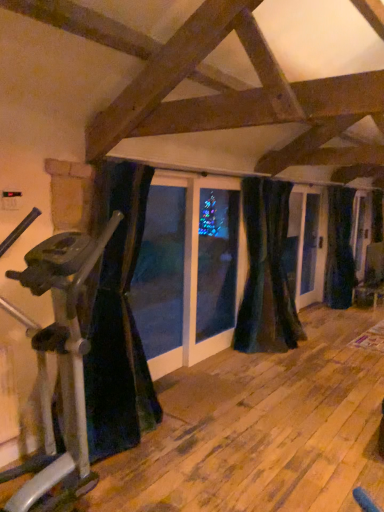
This screenshot has width=384, height=512. Describe the element at coordinates (267, 272) in the screenshot. I see `velvet dark blue curtain at center, which is the 2th curtain from back to front` at that location.

The height and width of the screenshot is (512, 384). Describe the element at coordinates (116, 318) in the screenshot. I see `black velvet curtain at left, positioned as the third curtain in right-to-left order` at that location.

Where is `black velvet curtain at left, arranged as the first curtain when viewed from the front`? black velvet curtain at left, arranged as the first curtain when viewed from the front is located at coordinates (116, 318).

The height and width of the screenshot is (512, 384). What do you see at coordinates (58, 367) in the screenshot?
I see `silver metallic stationary bicycle at left` at bounding box center [58, 367].

This screenshot has height=512, width=384. I want to click on velvet dark blue curtain at center, which appears as the second curtain when viewed from the right, so click(267, 272).

Is velvet dark blue curtain at center, which appears as the second curtain when viewed from the right, situated inside silver metallic stationary bicycle at left or outside?

The correct answer is: outside.

In terms of height, does velvet dark blue curtain at center, which appears as the 2th curtain when viewed from the left, look taller or shorter compared to silver metallic stationary bicycle at left?

Clearly, velvet dark blue curtain at center, which appears as the 2th curtain when viewed from the left, is taller compared to silver metallic stationary bicycle at left.

Between point (264, 342) and point (54, 279), which one is positioned behind?

The point (264, 342) is behind.

Which curtain is the 1st one when counting from the back of the black velvet curtain at left, positioned as the third curtain in right-to-left order? Please provide its 2D coordinates.

[(267, 272)]

From the image's perspective, is black velvet curtain at left, arranged as the first curtain when viewed from the front, above or below velvet dark blue curtain at center, marked as the 2th curtain in a front-to-back arrangement?

From the image's perspective, black velvet curtain at left, arranged as the first curtain when viewed from the front, appears below velvet dark blue curtain at center, marked as the 2th curtain in a front-to-back arrangement.

In the image, is black velvet curtain at left, positioned as the third curtain in right-to-left order, on the left side or the right side of velvet dark blue curtain at center, marked as the 2th curtain in a front-to-back arrangement?

black velvet curtain at left, positioned as the third curtain in right-to-left order, is positioned on velvet dark blue curtain at center, marked as the 2th curtain in a front-to-back arrangement,'s left side.

Is black velvet curtain at left, which appears as the 3th curtain when viewed from the back, oriented towards velvet dark blue curtain at center, which is the 2th curtain from back to front?

No, black velvet curtain at left, which appears as the 3th curtain when viewed from the back, is not aimed at velvet dark blue curtain at center, which is the 2th curtain from back to front.

Which of these two, dark blue velvet curtain at right, placed as the third curtain when sorted from left to right, or velvet dark blue curtain at center, which appears as the 2th curtain when viewed from the left, stands shorter?

With less height is velvet dark blue curtain at center, which appears as the 2th curtain when viewed from the left.

From a real-world perspective, between dark blue velvet curtain at right, placed as the third curtain when sorted from left to right, and velvet dark blue curtain at center, marked as the 2th curtain in a front-to-back arrangement, who is vertically higher?

In real-world perspective, velvet dark blue curtain at center, marked as the 2th curtain in a front-to-back arrangement, is above.

Does point (350, 194) appear closer or farther from the camera than point (268, 345)?

Point (350, 194) is positioned farther from the camera compared to point (268, 345).

Is dark blue velvet curtain at right, which ranks as the third curtain in front-to-back order, aimed at velvet dark blue curtain at center, which appears as the 2th curtain when viewed from the left?

No, dark blue velvet curtain at right, which ranks as the third curtain in front-to-back order, is not aimed at velvet dark blue curtain at center, which appears as the 2th curtain when viewed from the left.

Is silver metallic stationary bicycle at left wider than velvet dark blue curtain at center, marked as the 2th curtain in a front-to-back arrangement?

Correct, the width of silver metallic stationary bicycle at left exceeds that of velvet dark blue curtain at center, marked as the 2th curtain in a front-to-back arrangement.

From the image's perspective, is silver metallic stationary bicycle at left on velvet dark blue curtain at center, which is the 2th curtain from back to front?

Incorrect, from the image's perspective, silver metallic stationary bicycle at left is lower than velvet dark blue curtain at center, which is the 2th curtain from back to front.

Is silver metallic stationary bicycle at left far from velvet dark blue curtain at center, which appears as the 2th curtain when viewed from the left?

Indeed, silver metallic stationary bicycle at left is not near velvet dark blue curtain at center, which appears as the 2th curtain when viewed from the left.

Considering the relative sizes of silver metallic stationary bicycle at left and velvet dark blue curtain at center, which is the 2th curtain from back to front, in the image provided, is silver metallic stationary bicycle at left shorter than velvet dark blue curtain at center, which is the 2th curtain from back to front,?

Correct, silver metallic stationary bicycle at left is not as tall as velvet dark blue curtain at center, which is the 2th curtain from back to front.

In terms of size, does dark blue velvet curtain at right, the first curtain positioned from the back, appear bigger or smaller than black velvet curtain at left, which appears as the 3th curtain when viewed from the back?

In the image, dark blue velvet curtain at right, the first curtain positioned from the back, appears to be smaller than black velvet curtain at left, which appears as the 3th curtain when viewed from the back.

Between dark blue velvet curtain at right, which ranks as the third curtain in front-to-back order, and black velvet curtain at left, arranged as the first curtain when viewed from the front, which one appears on the left side from the viewer's perspective?

black velvet curtain at left, arranged as the first curtain when viewed from the front, is more to the left.

Would you say black velvet curtain at left, the first curtain when ordered from left to right, is part of dark blue velvet curtain at right, the first curtain positioned from the back,'s contents?

Definitely not — black velvet curtain at left, the first curtain when ordered from left to right, is not inside dark blue velvet curtain at right, the first curtain positioned from the back.

Is silver metallic stationary bicycle at left in front of or behind black velvet curtain at left, the first curtain when ordered from left to right, in the image?

silver metallic stationary bicycle at left is positioned closer to the viewer than black velvet curtain at left, the first curtain when ordered from left to right.

Is silver metallic stationary bicycle at left oriented towards black velvet curtain at left, positioned as the third curtain in right-to-left order?

No, silver metallic stationary bicycle at left is not oriented towards black velvet curtain at left, positioned as the third curtain in right-to-left order.

From a real-world perspective, is silver metallic stationary bicycle at left physically located above or below black velvet curtain at left, arranged as the first curtain when viewed from the front?

In terms of real-world spatial position, silver metallic stationary bicycle at left is below black velvet curtain at left, arranged as the first curtain when viewed from the front.

The image size is (384, 512). Find the location of `the 1st curtain positioned above the silver metallic stationary bicycle at left (from the image's perspective)`. the 1st curtain positioned above the silver metallic stationary bicycle at left (from the image's perspective) is located at coordinates (116, 318).

Is velvet dark blue curtain at center, which appears as the 2th curtain when viewed from the left, oriented away from dark blue velvet curtain at right, placed as the third curtain when sorted from left to right?

No, velvet dark blue curtain at center, which appears as the 2th curtain when viewed from the left, is not facing the opposite direction of dark blue velvet curtain at right, placed as the third curtain when sorted from left to right.

In the scene shown: From the image's perspective, is velvet dark blue curtain at center, which is the 2th curtain from back to front, above or below dark blue velvet curtain at right, which ranks as the third curtain in front-to-back order?

Clearly, from the image's perspective, velvet dark blue curtain at center, which is the 2th curtain from back to front, is below dark blue velvet curtain at right, which ranks as the third curtain in front-to-back order.

Is dark blue velvet curtain at right, the first curtain positioned from the back, inside velvet dark blue curtain at center, which appears as the 2th curtain when viewed from the left?

Definitely not — dark blue velvet curtain at right, the first curtain positioned from the back, is not inside velvet dark blue curtain at center, which appears as the 2th curtain when viewed from the left.

From the silver metallic stationary bicycle at left, count 2nd curtain to the right and point to it. Please provide its 2D coordinates.

[(267, 272)]

From a real-world perspective, count 1st curtains downward from the velvet dark blue curtain at center, marked as the 2th curtain in a front-to-back arrangement, and point to it. Please provide its 2D coordinates.

[(116, 318)]

Which object lies nearer to the anchor point velvet dark blue curtain at center, marked as the 2th curtain in a front-to-back arrangement, silver metallic stationary bicycle at left or black velvet curtain at left, arranged as the first curtain when viewed from the front?

Based on the image, black velvet curtain at left, arranged as the first curtain when viewed from the front, appears to be nearer to velvet dark blue curtain at center, marked as the 2th curtain in a front-to-back arrangement.

Looking at the image, which one is located closer to silver metallic stationary bicycle at left, black velvet curtain at left, the first curtain when ordered from left to right, or dark blue velvet curtain at right, the first curtain viewed from the right?

black velvet curtain at left, the first curtain when ordered from left to right, is closer to silver metallic stationary bicycle at left.

When comparing their distances from silver metallic stationary bicycle at left, does dark blue velvet curtain at right, which ranks as the third curtain in front-to-back order, or black velvet curtain at left, arranged as the first curtain when viewed from the front, seem closer?

black velvet curtain at left, arranged as the first curtain when viewed from the front.

Considering their positions, is dark blue velvet curtain at right, placed as the third curtain when sorted from left to right, positioned closer to silver metallic stationary bicycle at left than velvet dark blue curtain at center, which is the 2th curtain from back to front?

The object closer to silver metallic stationary bicycle at left is velvet dark blue curtain at center, which is the 2th curtain from back to front.

Looking at the image, which one is located further to dark blue velvet curtain at right, placed as the third curtain when sorted from left to right, velvet dark blue curtain at center, which appears as the 2th curtain when viewed from the left, or silver metallic stationary bicycle at left?

silver metallic stationary bicycle at left.

Considering their positions, is velvet dark blue curtain at center, which appears as the second curtain when viewed from the right, positioned further to silver metallic stationary bicycle at left than black velvet curtain at left, which appears as the 3th curtain when viewed from the back?

velvet dark blue curtain at center, which appears as the second curtain when viewed from the right.

Considering their positions, is velvet dark blue curtain at center, which is the 2th curtain from back to front, positioned further to black velvet curtain at left, arranged as the first curtain when viewed from the front, than dark blue velvet curtain at right, placed as the third curtain when sorted from left to right?

Among the two, dark blue velvet curtain at right, placed as the third curtain when sorted from left to right, is located further to black velvet curtain at left, arranged as the first curtain when viewed from the front.

Considering their positions, is velvet dark blue curtain at center, which appears as the second curtain when viewed from the right, positioned closer to dark blue velvet curtain at right, placed as the third curtain when sorted from left to right, than black velvet curtain at left, arranged as the first curtain when viewed from the front?

velvet dark blue curtain at center, which appears as the second curtain when viewed from the right, is closer to dark blue velvet curtain at right, placed as the third curtain when sorted from left to right.

This screenshot has width=384, height=512. In order to click on curtain between black velvet curtain at left, arranged as the first curtain when viewed from the front, and dark blue velvet curtain at right, the first curtain viewed from the right, in the front-back direction in this screenshot , I will do `click(267, 272)`.

This screenshot has height=512, width=384. In order to click on curtain between silver metallic stationary bicycle at left and velvet dark blue curtain at center, which appears as the second curtain when viewed from the right, from front to back in this screenshot , I will do `click(116, 318)`.